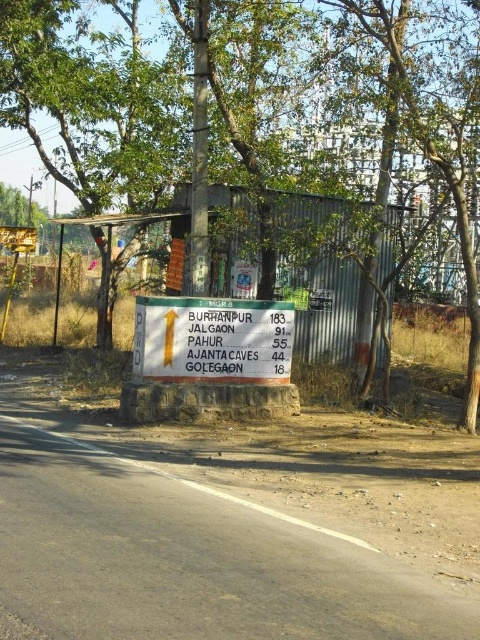
Question: Which object is positioned closest to the white plastic sign at center?

Choices:
 (A) green leafy tree at center
 (B) yellow plastic pole at left

Answer: (A)

Question: Can you confirm if white plastic sign at center is positioned to the right of yellow plastic pole at left?

Choices:
 (A) yes
 (B) no

Answer: (A)

Question: Can you confirm if white plastic sign at center is positioned below yellow plastic pole at left?

Choices:
 (A) yes
 (B) no

Answer: (A)

Question: Which point is farther to the camera?

Choices:
 (A) green leafy tree at center
 (B) yellow plastic pole at left

Answer: (B)

Question: Which point is closer to the camera?

Choices:
 (A) (257, 160)
 (B) (2, 323)

Answer: (A)

Question: In this image, where is green leafy tree at center located relative to yellow plastic pole at left?

Choices:
 (A) below
 (B) above

Answer: (B)